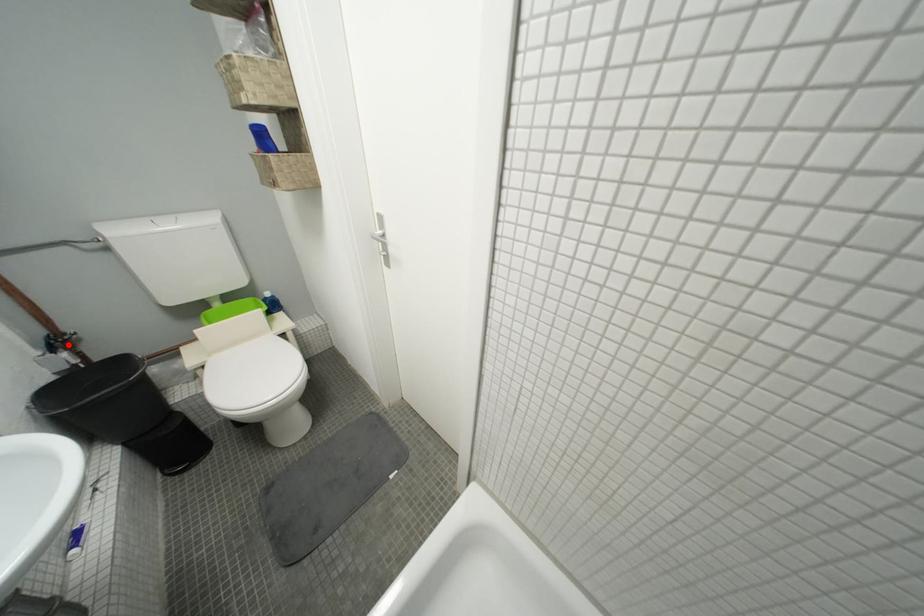
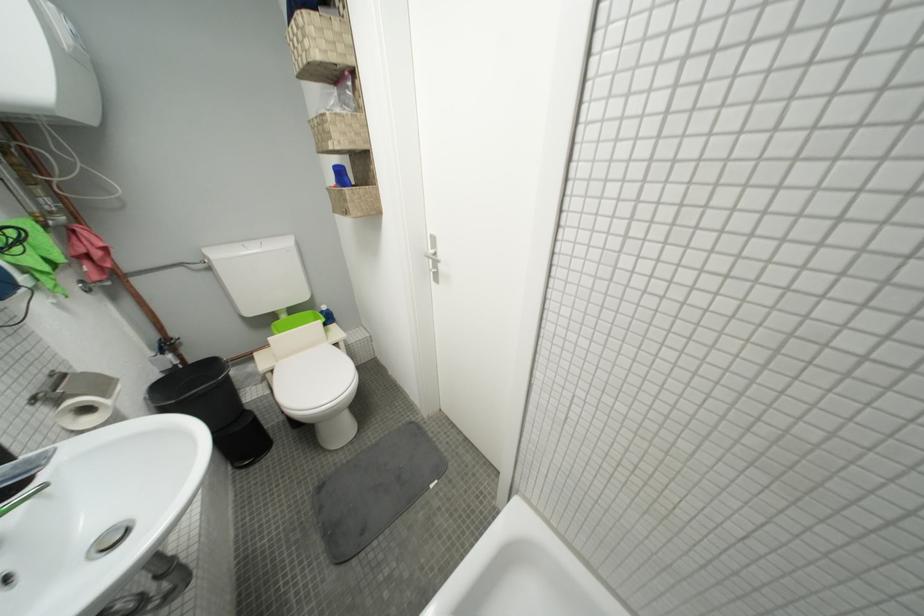
Question: I am providing you with two images of the same scene from different viewpoints. Given a red point in image1, look at the same physical point in image2. Is it:

Choices:
 (A) Closer to the viewpoint
 (B) Farther from the viewpoint

Answer: (A)